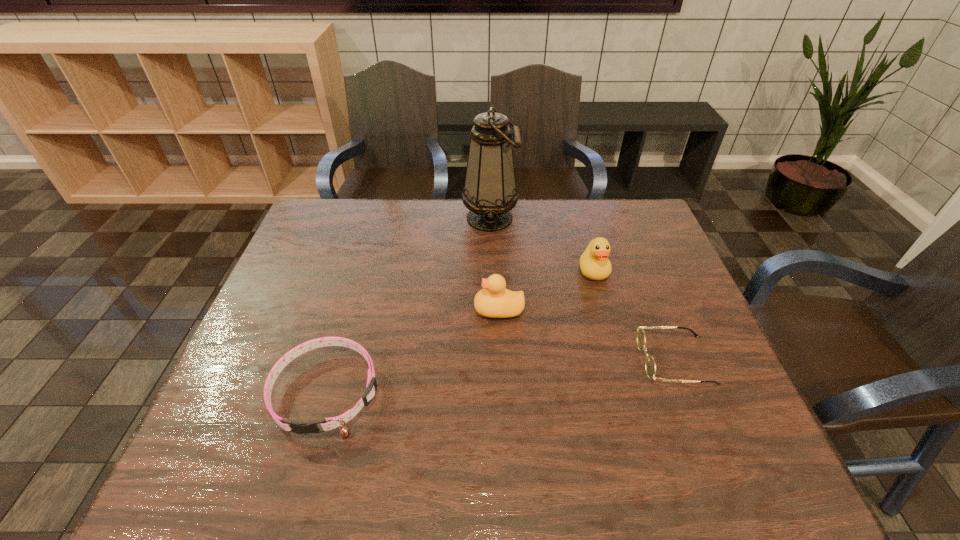
Find the location of `vacant area situated 0.120m at the beak of the right duck`. vacant area situated 0.120m at the beak of the right duck is located at coordinates (606, 316).

Locate an element on the screen. This screenshot has height=540, width=960. free space located 0.310m on the face of the third nearest object is located at coordinates (358, 309).

The image size is (960, 540). What are the coordinates of `free space located 0.220m on the face of the third nearest object` in the screenshot? It's located at (392, 309).

Find the location of `free space located 0.330m on the face of the third nearest object`. free space located 0.330m on the face of the third nearest object is located at coordinates (350, 309).

In order to click on free space located 0.360m on the lenses of the spectacles in this screenshot , I will do `click(490, 360)`.

Where is `free spot located 0.180m on the lenses of the spectacles`? free spot located 0.180m on the lenses of the spectacles is located at coordinates (564, 360).

At what (x,y) coordinates should I click in order to perform the action: click on vacant position located on the lenses of the spectacles. Please return your answer as a coordinate pair (x, y). Looking at the image, I should click on (615, 360).

You are a GUI agent. You are given a task and a screenshot of the screen. Output one action in this format:
    pyautogui.click(x=<x>, y=<y>)
    Task: Click on the object located at the far edge
    Image resolution: width=960 pixels, height=540 pixels.
    Given the screenshot: What is the action you would take?
    pyautogui.click(x=489, y=193)

Where is `object situated at the left edge`? object situated at the left edge is located at coordinates (327, 424).

This screenshot has height=540, width=960. I want to click on object that is at the right edge, so click(x=650, y=367).